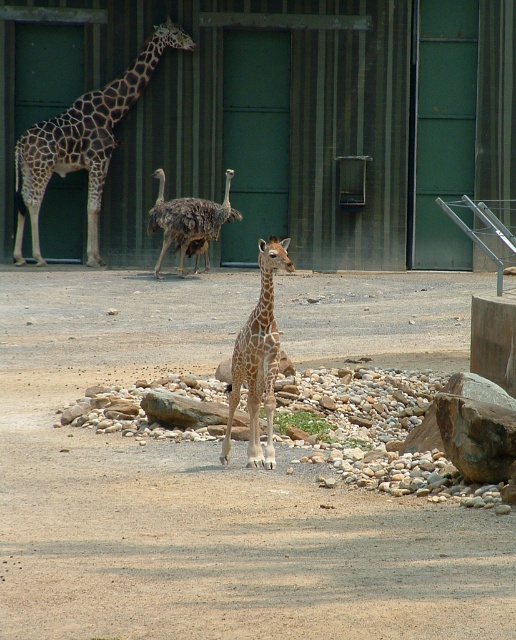
Between spotted fur giraffe at left and spotted fur giraffe at center, which one is positioned higher?

spotted fur giraffe at left

Is spotted fur giraffe at left positioned at the back of spotted fur giraffe at center?

That is True.

Find the location of `spotted fur giraffe at left`. spotted fur giraffe at left is located at coordinates (83, 141).

Measure the distance from spotted fur giraffe at center to brown feathered ostrich at center.

spotted fur giraffe at center and brown feathered ostrich at center are 14.05 meters apart.

Does point (269, 445) come in front of point (224, 202)?

Yes.

Is point (266, 392) positioned behind point (185, 218)?

That is False.

I want to click on spotted fur giraffe at center, so click(258, 358).

Is point (0, 401) positioned before point (180, 204)?

Yes.

Does brown sandy dirt at center appear under brown feathered ostrich at center?

Indeed, brown sandy dirt at center is positioned under brown feathered ostrich at center.

Who is more forward, (149,563) or (157,276)?

Point (149,563)

Image resolution: width=516 pixels, height=640 pixels. Find the location of `brown sandy dirt at center`. brown sandy dirt at center is located at coordinates (201, 493).